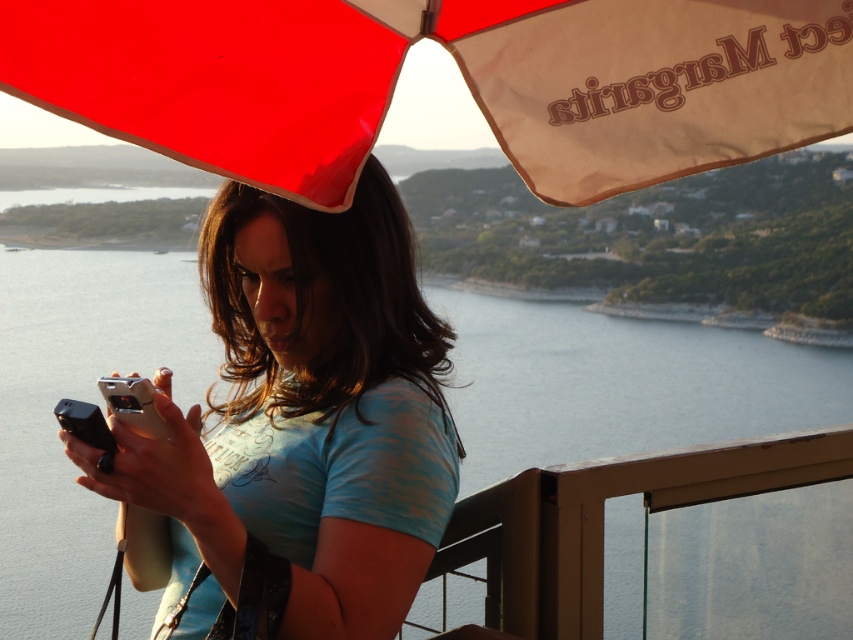
Does point (184, 61) come farther from viewer compared to point (444, 442)?

No, (184, 61) is in front of (444, 442).

Can you confirm if red fabric umbrella at upper center is bigger than matte blue shirt at center?

Incorrect, red fabric umbrella at upper center is not larger than matte blue shirt at center.

Is point (567, 186) farther from viewer compared to point (398, 422)?

That is True.

At what (x,y) coordinates should I click in order to perform the action: click on red fabric umbrella at upper center. Please return your answer as a coordinate pair (x, y). Looking at the image, I should click on (461, 72).

This screenshot has width=853, height=640. Find the location of `clear water at center`. clear water at center is located at coordinates (619, 385).

This screenshot has width=853, height=640. Describe the element at coordinates (619, 385) in the screenshot. I see `clear water at center` at that location.

Does point (540, 317) lie in front of point (305, 563)?

No.

The image size is (853, 640). I want to click on clear water at center, so click(x=619, y=385).

Does clear water at center have a lesser width compared to red fabric umbrella at upper center?

Indeed, clear water at center has a lesser width compared to red fabric umbrella at upper center.

Does point (12, 493) lie in front of point (830, 83)?

No, (12, 493) is behind (830, 83).

Where is `clear water at center`? This screenshot has height=640, width=853. clear water at center is located at coordinates (619, 385).